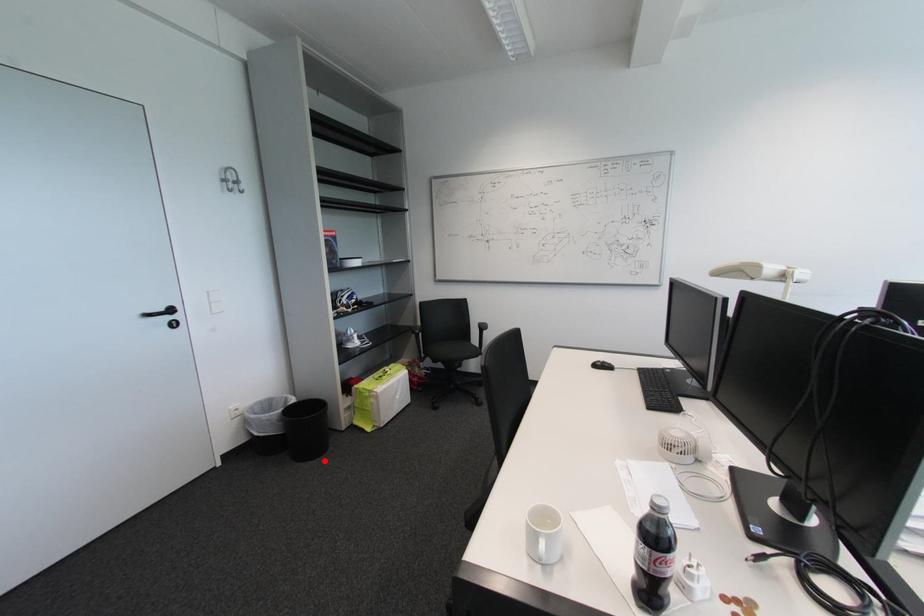
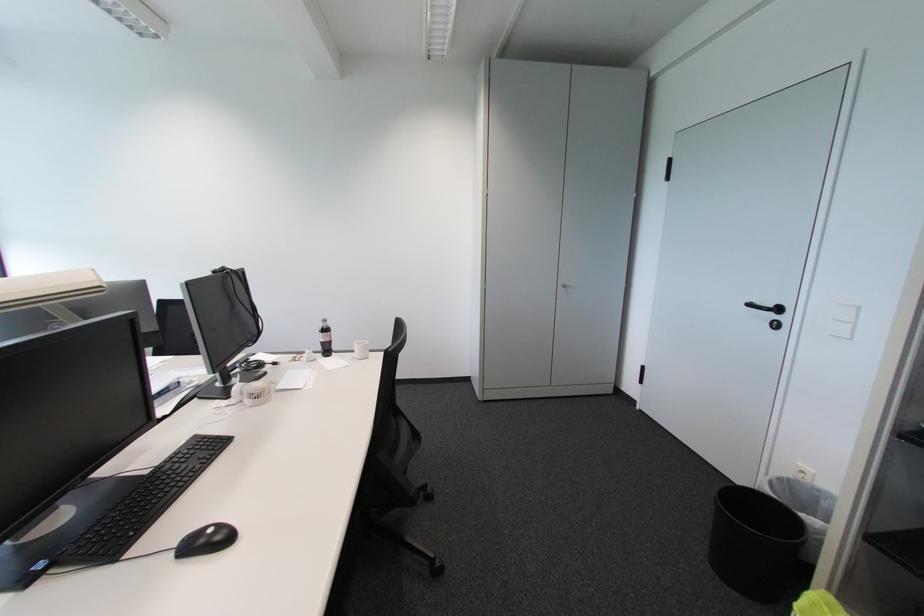
Question: I am providing you with two images of the same scene from different viewpoints. Given a red point in image1, look at the same physical point in image2. Is it:

Choices:
 (A) Closer to the viewpoint
 (B) Farther from the viewpoint

Answer: (A)